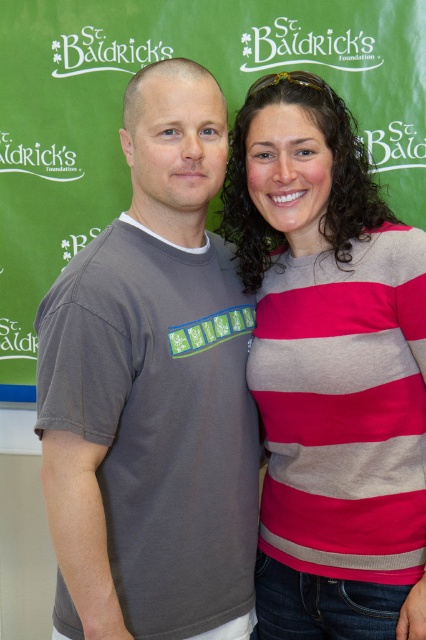
Can you confirm if striped sweater at right is wider than white matte text at upper center?

Yes, striped sweater at right is wider than white matte text at upper center.

Does striped sweater at right have a lesser height compared to white matte text at upper center?

No.

Between point (305, 300) and point (63, 44), which one is positioned in front?

Point (305, 300) is in front.

Locate an element on the screen. striped sweater at right is located at coordinates (330, 369).

Is the position of gray cotton t-shirt at left more distant than that of matte gray t-shirt at center?

No, it is not.

Does gray cotton t-shirt at left have a greater height compared to matte gray t-shirt at center?

No.

Does point (158, 164) lie behind point (77, 100)?

No, it is in front of (77, 100).

The width and height of the screenshot is (426, 640). I want to click on gray cotton t-shirt at left, so click(x=152, y=392).

Does striped sweater at right have a lesser width compared to matte gray t-shirt at center?

Indeed, striped sweater at right has a lesser width compared to matte gray t-shirt at center.

Is striped sweater at right shorter than matte gray t-shirt at center?

Indeed, striped sweater at right has a lesser height compared to matte gray t-shirt at center.

The height and width of the screenshot is (640, 426). I want to click on striped sweater at right, so tap(330, 369).